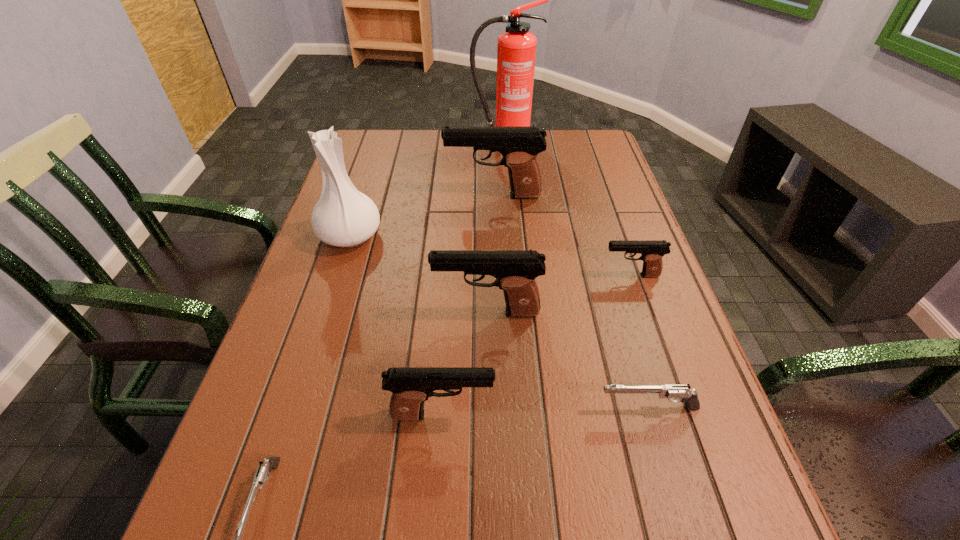
At what (x,y) coordinates should I click in order to perform the action: click on the second farthest pistol. Please return your answer as a coordinate pair (x, y). Looking at the image, I should click on (652, 251).

Find the location of a particular element. the third nearest black pistol is located at coordinates (652, 251).

Locate an element on the screen. The image size is (960, 540). the farther silver pistol is located at coordinates pos(682,392).

Where is `the right silver pistol`? the right silver pistol is located at coordinates (682, 392).

Identify the location of free spot located 0.080m at the nozzle of the fire extinguisher. The height and width of the screenshot is (540, 960). (x=505, y=161).

Image resolution: width=960 pixels, height=540 pixels. In order to click on vacant space located 0.080m on the right of the vase in this screenshot , I will do `click(414, 236)`.

At what (x,y) coordinates should I click in order to perform the action: click on vacant region located at the barrel of the farthest black pistol. Please return your answer as a coordinate pair (x, y). This screenshot has width=960, height=540. Looking at the image, I should click on (399, 196).

Locate an element on the screen. The width and height of the screenshot is (960, 540). free space located at the barrel of the farthest black pistol is located at coordinates [347, 196].

At what (x,y) coordinates should I click in order to perform the action: click on vacant position located 0.060m at the barrel of the farthest black pistol. Please return your answer as a coordinate pair (x, y). Looking at the image, I should click on (424, 196).

At what (x,y) coordinates should I click in order to perform the action: click on free space located 0.290m at the barrel of the third smallest black pistol. Please return your answer as a coordinate pair (x, y). Looking at the image, I should click on (299, 312).